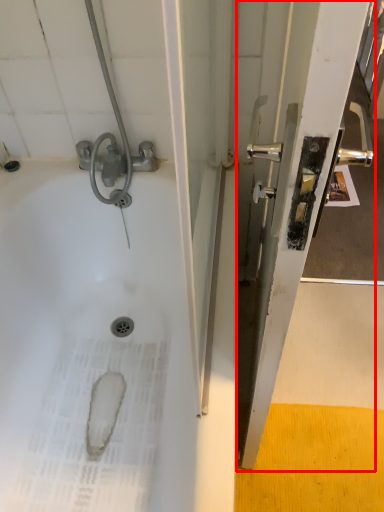
Question: From the image's perspective, where is screen door (annotated by the red box) located relative to bath?

Choices:
 (A) above
 (B) below

Answer: (A)